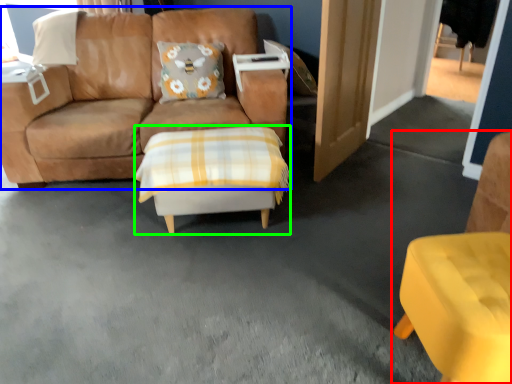
Question: Considering the real-world distances, which object is farthest from chair (highlighted by a red box)? studio couch (highlighted by a blue box) or table (highlighted by a green box)?

Choices:
 (A) studio couch
 (B) table

Answer: (A)